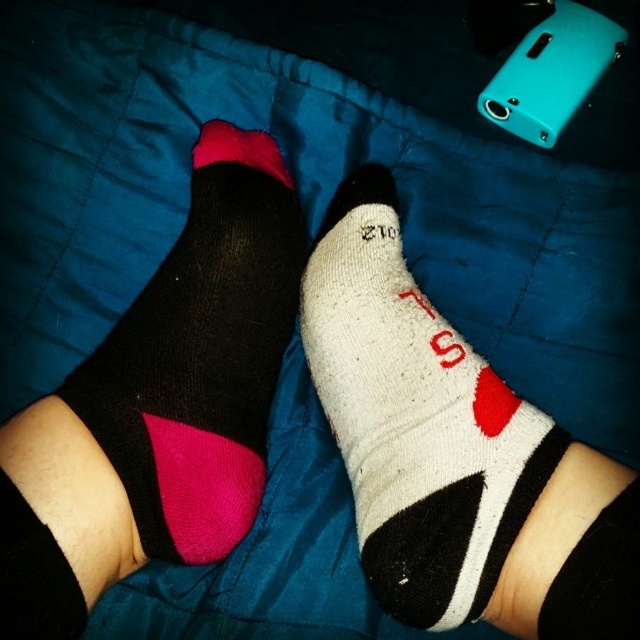
Is white cotton sock at center thinner than matte black sock at left?

Indeed, white cotton sock at center has a lesser width compared to matte black sock at left.

From the picture: How much distance is there between white cotton sock at center and matte black sock at left?

A distance of 9.23 inches exists between white cotton sock at center and matte black sock at left.

This screenshot has height=640, width=640. What do you see at coordinates (416, 419) in the screenshot?
I see `white cotton sock at center` at bounding box center [416, 419].

Identify the location of white cotton sock at center. (416, 419).